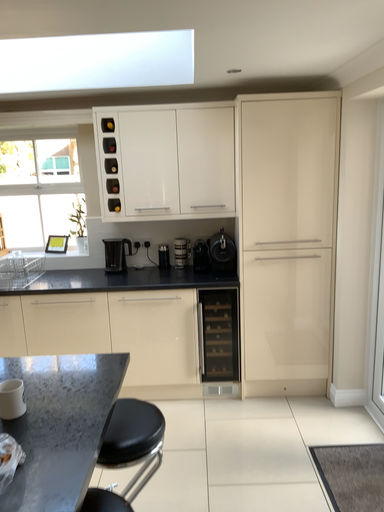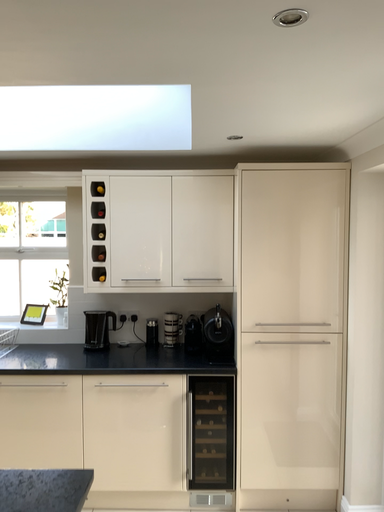
Question: How did the camera likely rotate when shooting the video?

Choices:
 (A) rotated downward
 (B) rotated upward

Answer: (B)